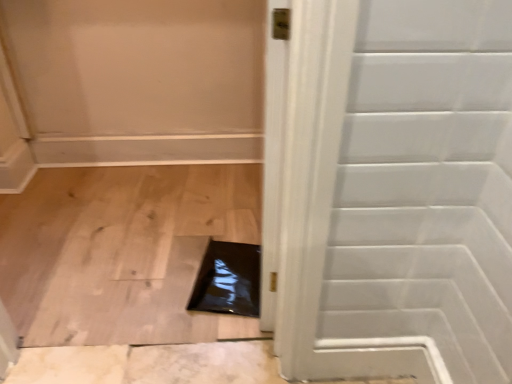
Question: Should I look upward or downward to see white glossy door at center?

Choices:
 (A) up
 (B) down

Answer: (B)

Question: From the image's perspective, would you say white glossy door at center is positioned over black glossy hole at center?

Choices:
 (A) no
 (B) yes

Answer: (B)

Question: Can you confirm if white glossy door at center is wider than black glossy hole at center?

Choices:
 (A) no
 (B) yes

Answer: (A)

Question: Is white glossy door at center with black glossy hole at center?

Choices:
 (A) yes
 (B) no

Answer: (B)

Question: Is white glossy door at center outside of black glossy hole at center?

Choices:
 (A) no
 (B) yes

Answer: (B)

Question: Can you confirm if white glossy door at center is taller than black glossy hole at center?

Choices:
 (A) yes
 (B) no

Answer: (A)

Question: Is white glossy door at center at the left side of black glossy hole at center?

Choices:
 (A) no
 (B) yes

Answer: (A)

Question: Is black glossy hole at center oriented towards white glossy door at center?

Choices:
 (A) no
 (B) yes

Answer: (A)

Question: Considering the relative sizes of black glossy hole at center and white glossy door at center in the image provided, is black glossy hole at center smaller than white glossy door at center?

Choices:
 (A) yes
 (B) no

Answer: (A)

Question: From a real-world perspective, is black glossy hole at center physically above white glossy door at center?

Choices:
 (A) yes
 (B) no

Answer: (B)

Question: Is black glossy hole at center completely or partially outside of white glossy door at center?

Choices:
 (A) yes
 (B) no

Answer: (A)

Question: Does black glossy hole at center have a larger size compared to white glossy door at center?

Choices:
 (A) yes
 (B) no

Answer: (B)

Question: Is the depth of black glossy hole at center greater than that of white glossy door at center?

Choices:
 (A) yes
 (B) no

Answer: (A)

Question: Looking at the image, does white glossy door at center seem bigger or smaller compared to black glossy hole at center?

Choices:
 (A) small
 (B) big

Answer: (B)